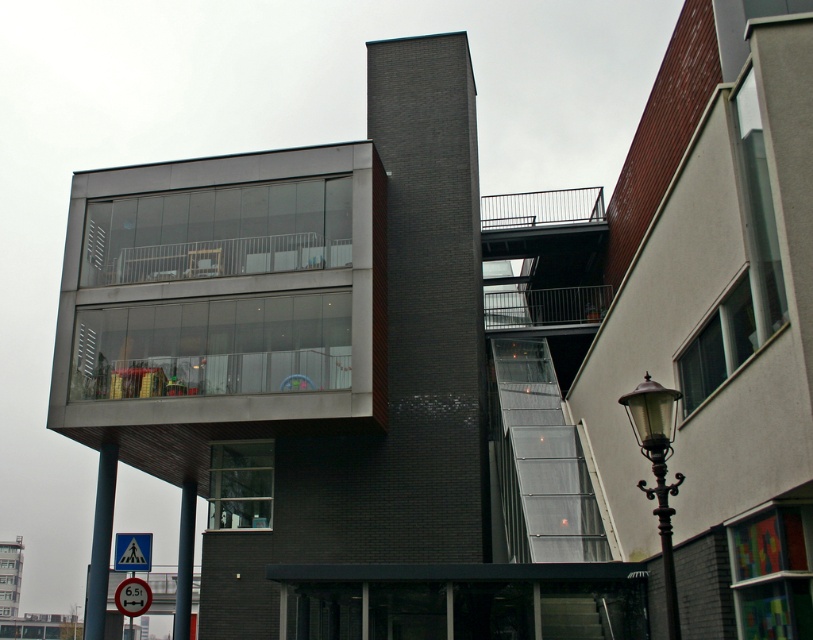
Is point (663, 541) positioned before point (531, 324)?

Yes, point (663, 541) is closer to viewer.

Can you confirm if black wrought iron streetlight at lower right is shorter than metallic gray balcony at upper center?

No.

The width and height of the screenshot is (813, 640). Describe the element at coordinates (657, 468) in the screenshot. I see `black wrought iron streetlight at lower right` at that location.

Where is `black wrought iron streetlight at lower right`? This screenshot has width=813, height=640. black wrought iron streetlight at lower right is located at coordinates (657, 468).

Which of these two, metallic gray balcony at upper center or yellow plastic triangle at lower left, stands taller?

Standing taller between the two is metallic gray balcony at upper center.

Can you confirm if metallic gray balcony at upper center is positioned to the left of yellow plastic triangle at lower left?

In fact, metallic gray balcony at upper center is to the right of yellow plastic triangle at lower left.

Describe the element at coordinates (546, 305) in the screenshot. This screenshot has width=813, height=640. I see `metallic gray balcony at upper center` at that location.

This screenshot has width=813, height=640. Identify the location of metallic gray balcony at upper center. (546, 305).

Is yellow plastic triangle at lower left bigger than red plastic speed limit sign at lower left?

Incorrect, yellow plastic triangle at lower left is not larger than red plastic speed limit sign at lower left.

Who is lower down, yellow plastic triangle at lower left or red plastic speed limit sign at lower left?

red plastic speed limit sign at lower left is below.

Measure the distance between yellow plastic triangle at lower left and camera.

yellow plastic triangle at lower left is 58.81 feet from camera.

Where is `yellow plastic triangle at lower left`? yellow plastic triangle at lower left is located at coordinates (133, 552).